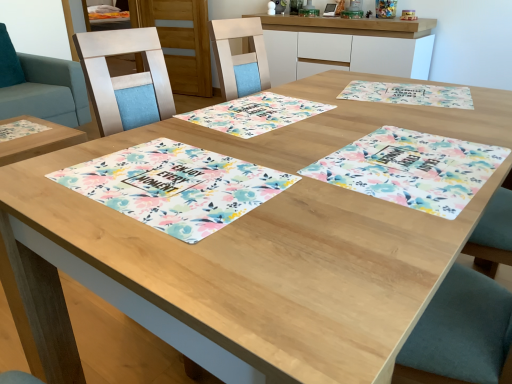
Question: Is the depth of teal fabric swivel chair at upper left less than that of white glossy cabinet at upper center, which appears as the 2th cabinetry when viewed from the back?

Choices:
 (A) no
 (B) yes

Answer: (B)

Question: Does teal fabric swivel chair at upper left appear on the right side of white glossy cabinet at upper center, which is counted as the second cabinetry, starting from the left?

Choices:
 (A) no
 (B) yes

Answer: (A)

Question: Is teal fabric swivel chair at upper left facing away from white glossy cabinet at upper center, which is counted as the second cabinetry, starting from the left?

Choices:
 (A) no
 (B) yes

Answer: (A)

Question: Considering the relative sizes of teal fabric swivel chair at upper left and white glossy cabinet at upper center, which is counted as the second cabinetry, starting from the left, in the image provided, is teal fabric swivel chair at upper left taller than white glossy cabinet at upper center, which is counted as the second cabinetry, starting from the left,?

Choices:
 (A) no
 (B) yes

Answer: (B)

Question: Can you confirm if teal fabric swivel chair at upper left is positioned to the left of white glossy cabinet at upper center, marked as the first cabinetry in a right-to-left arrangement?

Choices:
 (A) yes
 (B) no

Answer: (A)

Question: From the image's perspective, is floral fabric placemat at center, which is the second place mat from right to left, positioned above or below teal fabric swivel chair at upper left?

Choices:
 (A) below
 (B) above

Answer: (A)

Question: Is floral fabric placemat at center, positioned as the third place mat in left-to-right order, bigger or smaller than teal fabric swivel chair at upper left?

Choices:
 (A) small
 (B) big

Answer: (A)

Question: Considering the positions of point (358, 185) and point (5, 44), is point (358, 185) closer or farther from the camera than point (5, 44)?

Choices:
 (A) farther
 (B) closer

Answer: (B)

Question: Which is correct: floral fabric placemat at center, positioned as the third place mat in left-to-right order, is inside teal fabric swivel chair at upper left, or outside of it?

Choices:
 (A) outside
 (B) inside

Answer: (A)

Question: From the image's perspective, relative to floral fabric placemat at center, positioned as the third place mat in left-to-right order, is floral fabric placemat at upper right, which is the fourth place mat in left-to-right order, above or below?

Choices:
 (A) below
 (B) above

Answer: (B)

Question: Is floral fabric placemat at upper right, which is the fourth place mat in left-to-right order, to the left or to the right of floral fabric placemat at center, positioned as the third place mat in left-to-right order, in the image?

Choices:
 (A) right
 (B) left

Answer: (A)

Question: Considering the positions of floral fabric placemat at upper right, marked as the first place mat in a right-to-left arrangement, and floral fabric placemat at center, which is the second place mat from right to left, in the image, is floral fabric placemat at upper right, marked as the first place mat in a right-to-left arrangement, taller or shorter than floral fabric placemat at center, which is the second place mat from right to left,?

Choices:
 (A) tall
 (B) short

Answer: (B)

Question: From a real-world perspective, relative to floral fabric placemat at center, positioned as the third place mat in left-to-right order, is floral fabric placemat at upper right, marked as the first place mat in a right-to-left arrangement, vertically above or below?

Choices:
 (A) below
 (B) above

Answer: (A)

Question: From a real-world perspective, is floral fabric placemat at center, the 1th place mat when ordered from left to right, physically located above or below floral fabric placemat at center, positioned as the third place mat in left-to-right order?

Choices:
 (A) below
 (B) above

Answer: (B)

Question: Is floral fabric placemat at center, which is counted as the 4th place mat, starting from the right, inside the boundaries of floral fabric placemat at center, positioned as the third place mat in left-to-right order, or outside?

Choices:
 (A) outside
 (B) inside

Answer: (A)